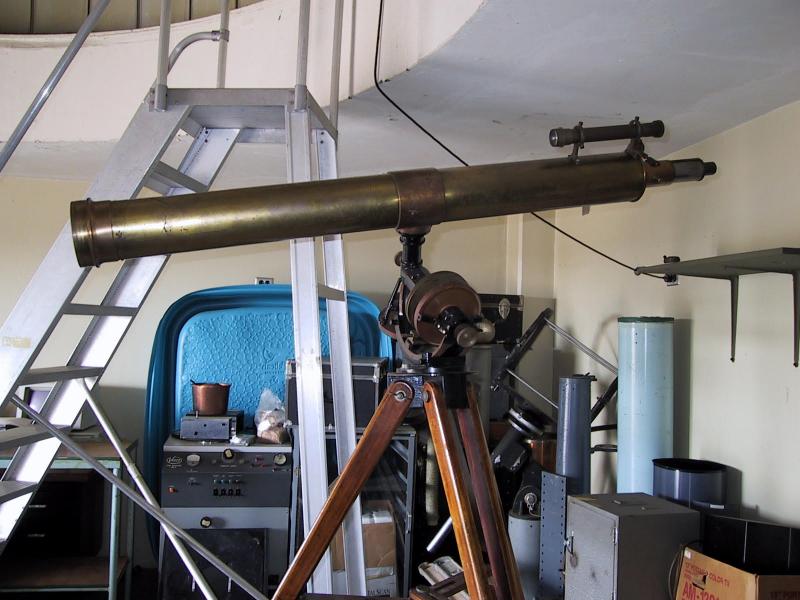
Locate an element on the screen. The height and width of the screenshot is (600, 800). workbench is located at coordinates (100, 450).